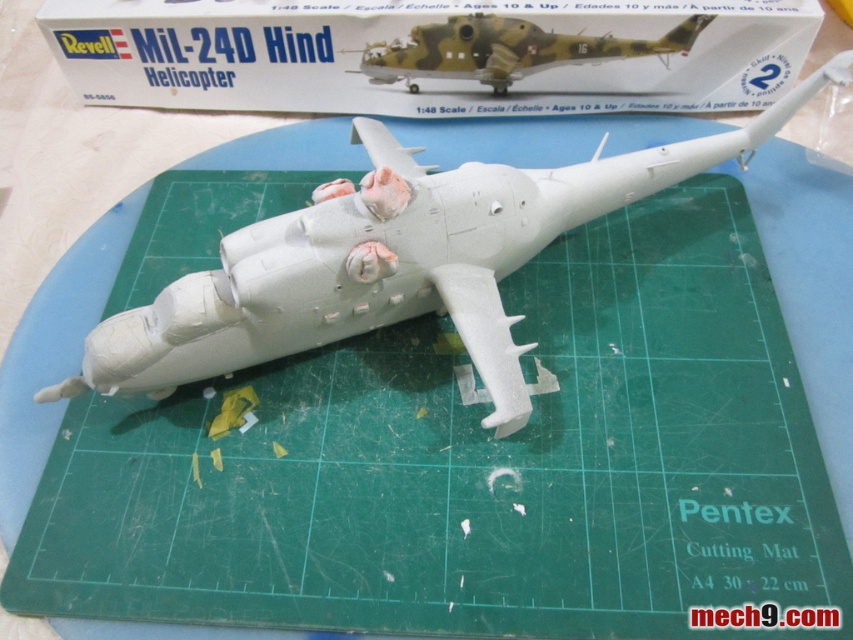
Based on the photo, can you confirm if matte white plastic box at upper center is positioned above white matte helicopter at center?

Correct, matte white plastic box at upper center is located above white matte helicopter at center.

Can you confirm if matte white plastic box at upper center is bigger than white matte helicopter at center?

No.

The width and height of the screenshot is (853, 640). Find the location of `matte white plastic box at upper center`. matte white plastic box at upper center is located at coordinates (431, 52).

Find the location of a particular element. This screenshot has height=640, width=853. matte white plastic box at upper center is located at coordinates (431, 52).

Is matte white plastic box at upper center smaller than camouflage plastic helicopter at center?

Incorrect, matte white plastic box at upper center is not smaller in size than camouflage plastic helicopter at center.

Is matte white plastic box at upper center wider than camouflage plastic helicopter at center?

Yes, matte white plastic box at upper center is wider than camouflage plastic helicopter at center.

Find the location of `matte white plastic box at upper center`. matte white plastic box at upper center is located at coordinates (431, 52).

The width and height of the screenshot is (853, 640). I want to click on matte white plastic box at upper center, so click(431, 52).

Who is shorter, white matte helicopter at center or camouflage plastic helicopter at center?

With less height is camouflage plastic helicopter at center.

Does white matte helicopter at center have a larger size compared to camouflage plastic helicopter at center?

Yes, white matte helicopter at center is bigger than camouflage plastic helicopter at center.

Between point (339, 332) and point (491, 13), which one is positioned behind?

Point (491, 13)

What are the coordinates of `white matte helicopter at center` in the screenshot? It's located at (393, 260).